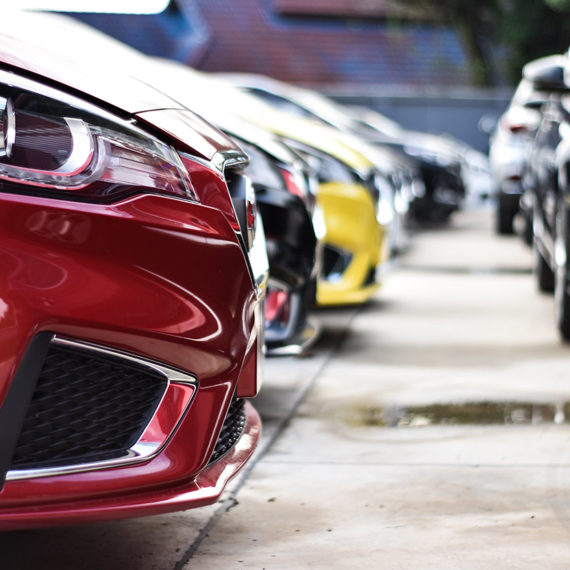
Where is `lights`? This screenshot has width=570, height=570. lights is located at coordinates (68, 157), (270, 180), (336, 166), (401, 178), (526, 122).